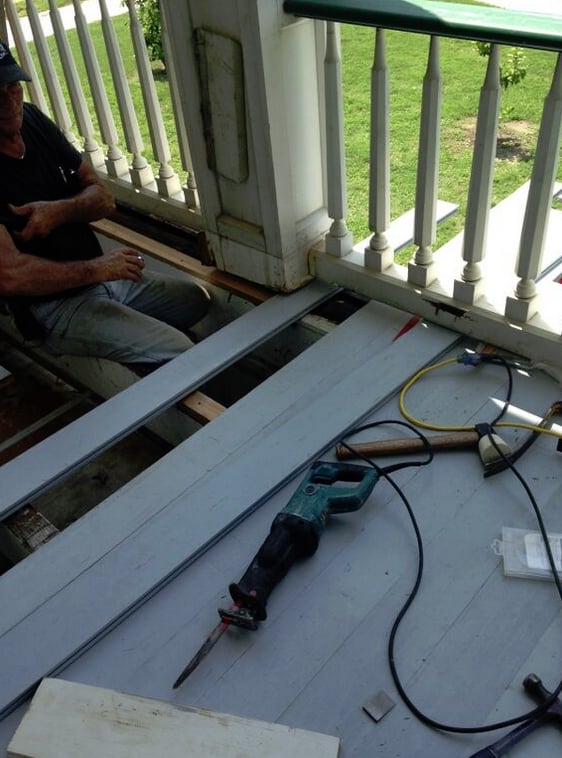
The image size is (562, 758). Find the location of `cord`. cord is located at coordinates (398, 399), (528, 490), (414, 590).